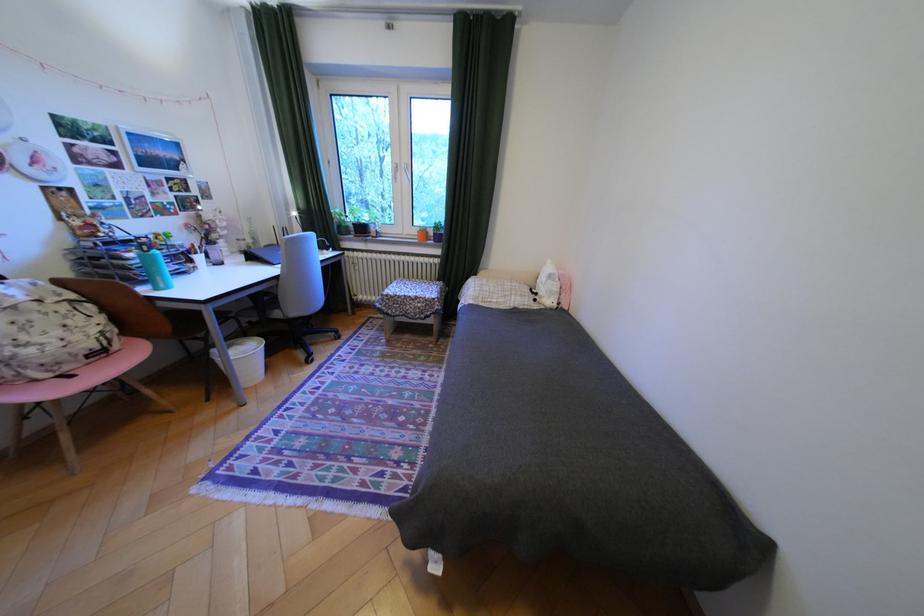
Where is `purple flower pot`? This screenshot has width=924, height=616. purple flower pot is located at coordinates (359, 220).